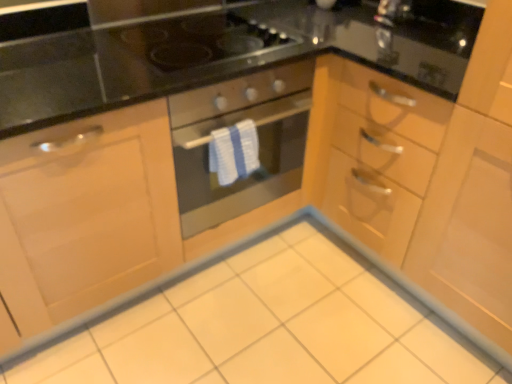
The image size is (512, 384). Find the location of `white glossy ceramic tile at center`. white glossy ceramic tile at center is located at coordinates (266, 327).

What do you see at coordinates (198, 41) in the screenshot? I see `black glass gas stove at upper center` at bounding box center [198, 41].

Image resolution: width=512 pixels, height=384 pixels. Identify the location of white glossy ceramic tile at center. point(266,327).

Does point (204, 53) come behind point (215, 119)?

Yes, point (204, 53) is farther from viewer.

Does black glass gas stove at upper center appear on the right side of matte black oven at center?

Incorrect, black glass gas stove at upper center is not on the right side of matte black oven at center.

How different are the orientations of black glass gas stove at upper center and matte black oven at center in degrees?

They differ by 2.01 degrees in their facing directions.

From a real-world perspective, is black glass gas stove at upper center over matte black oven at center?

Yes.

Does point (128, 36) come farther from viewer compared to point (248, 304)?

No, (128, 36) is in front of (248, 304).

Is black glass gas stove at upper center bigger than white glossy ceramic tile at center?

No.

Do you think black glass gas stove at upper center is within white glossy ceramic tile at center, or outside of it?

The correct answer is: outside.

Considering the sizes of objects black glass gas stove at upper center and white glossy ceramic tile at center in the image provided, who is shorter, black glass gas stove at upper center or white glossy ceramic tile at center?

With less height is white glossy ceramic tile at center.

Is matte black oven at center behind white glossy ceramic tile at center?

Yes.

From a real-world perspective, which object rests below the other?

From a 3D spatial view, white glossy ceramic tile at center is below.

Could you tell me if matte black oven at center is turned towards white glossy ceramic tile at center?

No, matte black oven at center does not turn towards white glossy ceramic tile at center.

From the image's perspective, is matte black oven at center on white glossy ceramic tile at center?

Yes, from the image's perspective, matte black oven at center is on top of white glossy ceramic tile at center.

Is point (176, 156) positioned after point (157, 56)?

Yes, it is behind point (157, 56).

Considering the sizes of objects matte black oven at center and black glass gas stove at upper center in the image provided, who is thinner, matte black oven at center or black glass gas stove at upper center?

Thinner between the two is black glass gas stove at upper center.

Between matte black oven at center and black glass gas stove at upper center, which one has more height?

With more height is matte black oven at center.

Consider the image. In the image, is matte black oven at center positioned in front of or behind black glass gas stove at upper center?

In the image, matte black oven at center appears in front of black glass gas stove at upper center.

Is white glossy ceramic tile at center located outside matte black oven at center?

Absolutely, white glossy ceramic tile at center is external to matte black oven at center.

Consider the image. Considering the relative sizes of white glossy ceramic tile at center and matte black oven at center in the image provided, is white glossy ceramic tile at center taller than matte black oven at center?

In fact, white glossy ceramic tile at center may be shorter than matte black oven at center.

Could you tell me if white glossy ceramic tile at center is facing matte black oven at center?

No, white glossy ceramic tile at center does not turn towards matte black oven at center.

Between white glossy ceramic tile at center and black glass gas stove at upper center, which one has smaller size?

Smaller between the two is black glass gas stove at upper center.

From a real-world perspective, is white glossy ceramic tile at center located higher than black glass gas stove at upper center?

No.

Which object is further away from the camera, white glossy ceramic tile at center or black glass gas stove at upper center?

black glass gas stove at upper center is further from the camera.

Is black glass gas stove at upper center at the back of white glossy ceramic tile at center?

No.

Where is `oven in front of the black glass gas stove at upper center`? This screenshot has height=384, width=512. oven in front of the black glass gas stove at upper center is located at coordinates (257, 143).

Where is `gas stove lying on the left of white glossy ceramic tile at center`? gas stove lying on the left of white glossy ceramic tile at center is located at coordinates (198, 41).

Consider the image. Which object lies further to the anchor point black glass gas stove at upper center, matte black oven at center or white glossy ceramic tile at center?

Based on the image, white glossy ceramic tile at center appears to be further to black glass gas stove at upper center.

Considering their positions, is white glossy ceramic tile at center positioned further to matte black oven at center than black glass gas stove at upper center?

white glossy ceramic tile at center lies further to matte black oven at center than the other object.

In the scene shown: Which object lies nearer to the anchor point matte black oven at center, black glass gas stove at upper center or white glossy ceramic tile at center?

black glass gas stove at upper center is positioned closer to the anchor matte black oven at center.

Estimate the real-world distances between objects in this image. Which object is closer to white glossy ceramic tile at center, black glass gas stove at upper center or matte black oven at center?

matte black oven at center.

From the image, which object appears to be farther from black glass gas stove at upper center, white glossy ceramic tile at center or matte black oven at center?

Based on the image, white glossy ceramic tile at center appears to be further to black glass gas stove at upper center.

From the image, which object appears to be nearer to white glossy ceramic tile at center, matte black oven at center or black glass gas stove at upper center?

The object closer to white glossy ceramic tile at center is matte black oven at center.

Image resolution: width=512 pixels, height=384 pixels. Find the location of `oven between black glass gas stove at upper center and white glossy ceramic tile at center vertically`. oven between black glass gas stove at upper center and white glossy ceramic tile at center vertically is located at coordinates (257, 143).